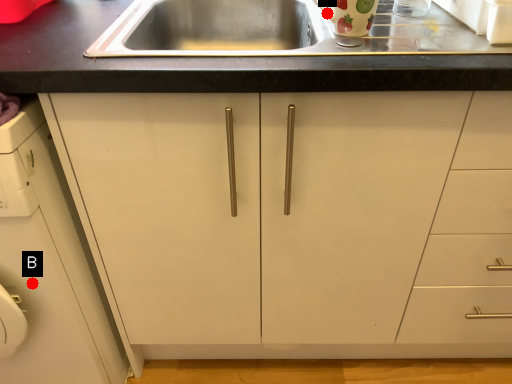
Question: Two points are circled on the image, labeled by A and B beside each circle. Among these points, which one is nearest to the camera?

Choices:
 (A) A is closer
 (B) B is closer

Answer: (A)